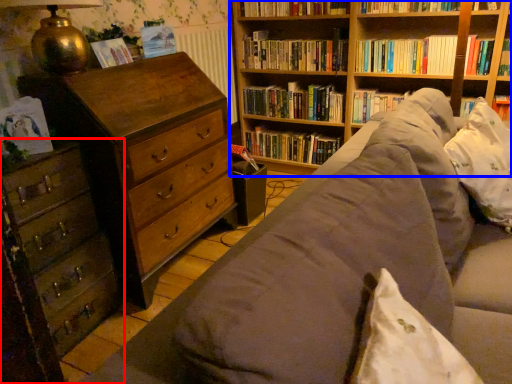
Question: Which object is further to the camera taking this photo, chest of drawers (highlighted by a red box) or bookcase (highlighted by a blue box)?

Choices:
 (A) chest of drawers
 (B) bookcase

Answer: (B)